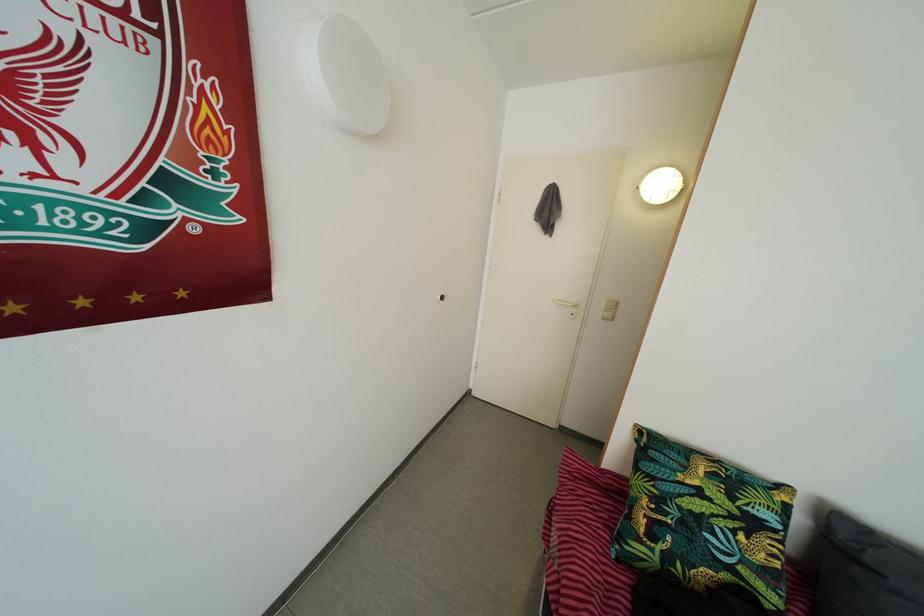
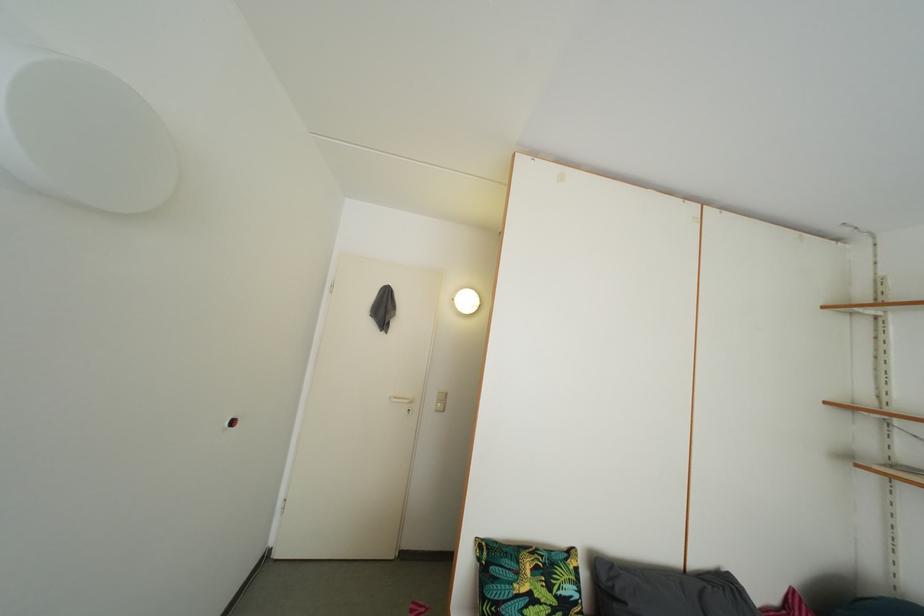
Locate, in the second image, the point that corresponds to point 691,460 in the first image.

(521, 562)